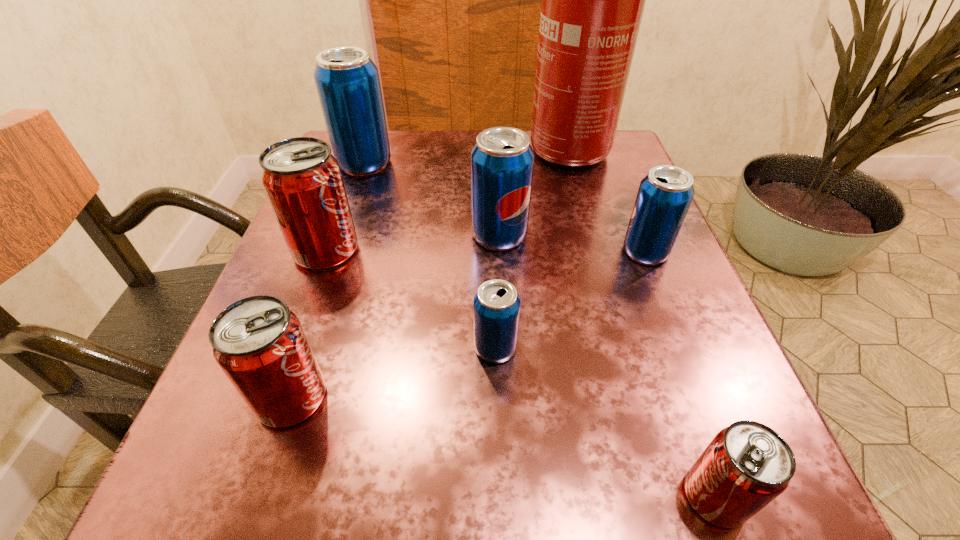
I want to click on the tallest object, so click(x=593, y=0).

Locate an element on the screen. fire extinguisher is located at coordinates (593, 0).

At what (x,y) coordinates should I click in order to perform the action: click on the leftmost blue pop soda. Please return your answer as a coordinate pair (x, y). Looking at the image, I should click on (347, 81).

Where is `the seventh shortest object`? This screenshot has width=960, height=540. the seventh shortest object is located at coordinates (347, 81).

The width and height of the screenshot is (960, 540). I want to click on the second biggest blue pop soda, so click(x=502, y=160).

This screenshot has width=960, height=540. I want to click on the farthest red pop soda, so click(302, 179).

Find the location of `the third biggest blue pop soda`. the third biggest blue pop soda is located at coordinates (664, 196).

I want to click on the second smallest red pop soda, so click(x=260, y=345).

At what (x,y) coordinates should I click in order to perform the action: click on the second nearest pop soda. Please return your answer as a coordinate pair (x, y). Image resolution: width=960 pixels, height=540 pixels. Looking at the image, I should click on (260, 345).

You are a GUI agent. You are given a task and a screenshot of the screen. Output one action in this format:
    pyautogui.click(x=<x>, y=<y>)
    Task: Click on the smallest blue pop soda
    This screenshot has height=540, width=960.
    Given the screenshot: What is the action you would take?
    pyautogui.click(x=496, y=309)